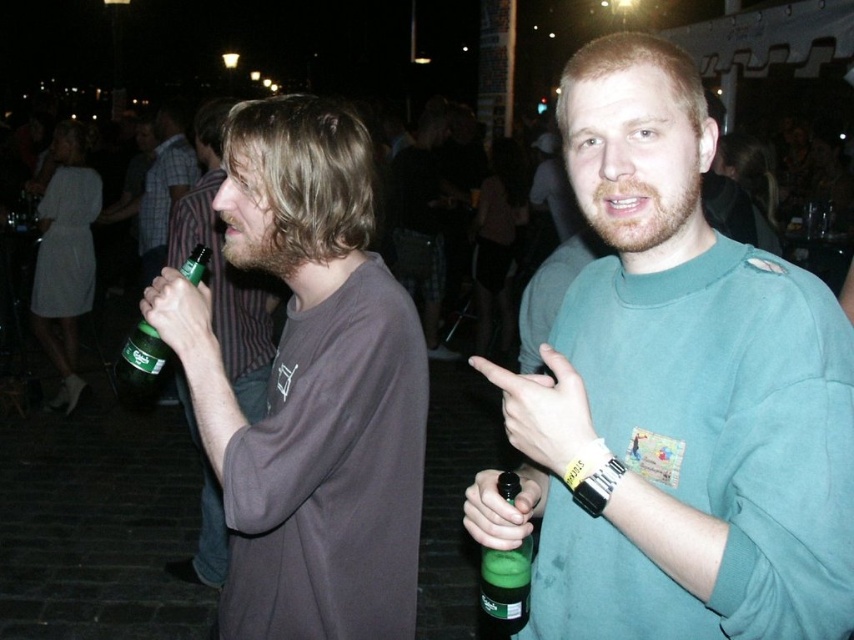
Question: Which of the following is the closest to the observer?

Choices:
 (A) green matte bottle at center
 (B) matte green bottle at left
 (C) green glass bottle at left
 (D) matte brown shirt at left

Answer: (A)

Question: Where is green matte bottle at center located in relation to green glass bottle at left in the image?

Choices:
 (A) below
 (B) above

Answer: (B)

Question: Which point is farther to the camera?

Choices:
 (A) (186, 198)
 (B) (496, 588)
 (C) (539, 432)

Answer: (A)

Question: Which object appears closest to the camera in this image?

Choices:
 (A) matte brown shirt at left
 (B) green glass bottle at left

Answer: (A)

Question: Can you confirm if green matte shirt at center is thinner than matte green bottle at left?

Choices:
 (A) no
 (B) yes

Answer: (B)

Question: In this image, where is green matte shirt at center located relative to green matte bottle at center?

Choices:
 (A) left
 (B) right

Answer: (B)